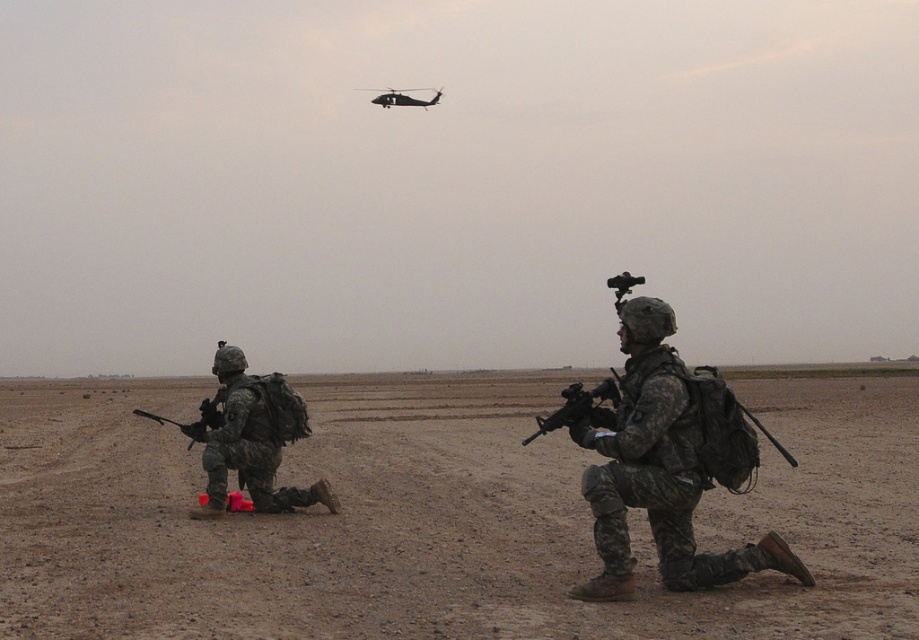
You are a soldier in the desert and need to communicate the position of the black matte helicopter at upper center relative to the matte black rifle at left. What would you say?

The black matte helicopter at upper center is above the matte black rifle at left.

You are a drone operator trying to capture a clear image of the camouflage fabric uniform at left and the black matte helicopter at upper center. Which object will appear wider in your camera feed?

The black matte helicopter at upper center will appear wider in the camera feed because it has a greater width than the camouflage fabric uniform at left.